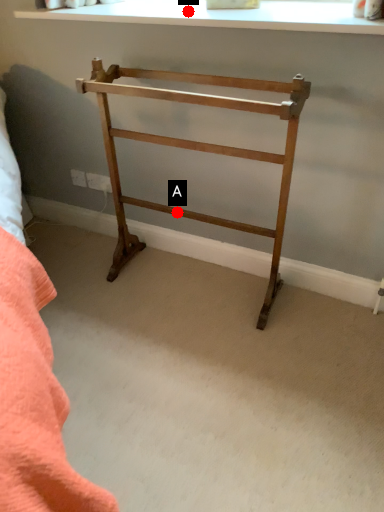
Question: Two points are circled on the image, labeled by A and B beside each circle. Which point is closer to the camera?

Choices:
 (A) A is closer
 (B) B is closer

Answer: (B)